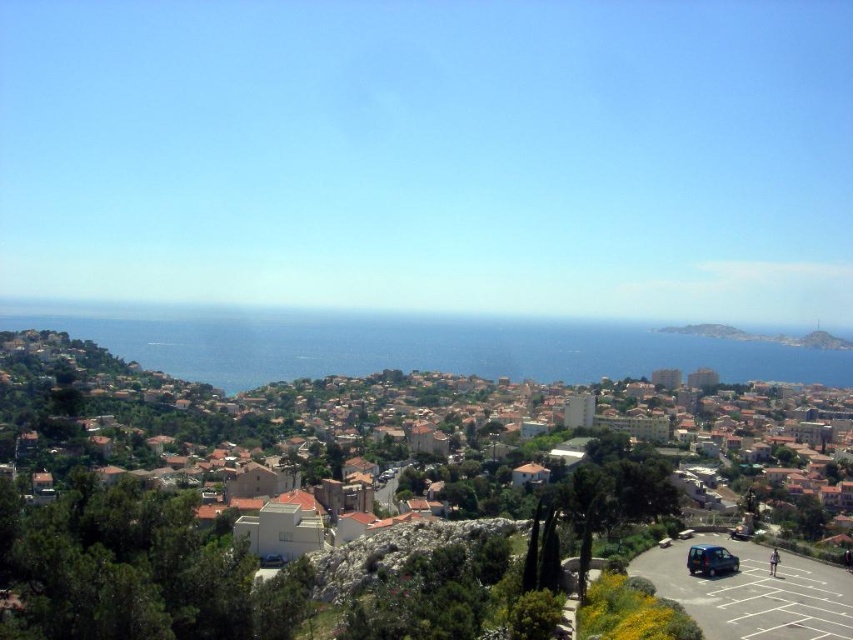
You are a tourist standing at the edge of the coastal town and looking out towards the blue water at center and the metallic blue van at lower right. Which object appears larger in the scene?

The blue water at center appears larger because it is taller than the metallic blue van at lower right.

You are a tourist planning to take a photo of the coastal town. You want to capture both the orange tiled roofs at center and the blue water at center in your shot. Which of the two elements will appear narrower in the photo?

The orange tiled roofs at center will appear narrower in the photo because its width is less than the blue water at center.

You are a tourist standing at the edge of the coastal town and want to take a photo of the orange tiled roofs at center and the metallic blue van at lower right. To ensure both are in the frame, should you position yourself to the left or right of the road?

You should position yourself to the right of the road. Since the orange tiled roofs at center are to the left of the metallic blue van at lower right, placing yourself to the right of the road allows both objects to be captured in the same frame without obstruction.